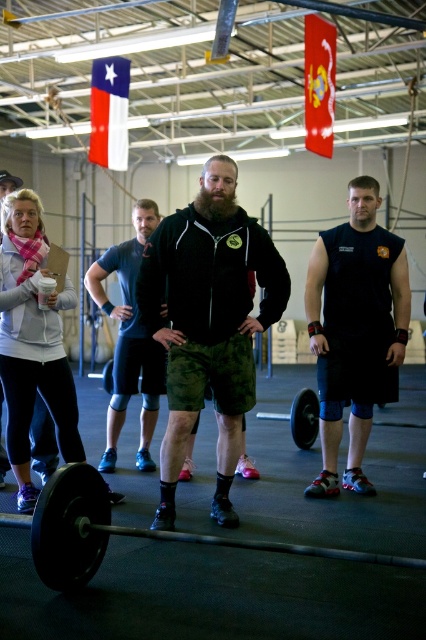
Is point (54, 538) positioned behind point (97, 266)?

No, it is not.

Which is above, black rubber barbell at center or dark blue fabric shorts at center?

dark blue fabric shorts at center is higher up.

I want to click on black rubber barbell at center, so click(x=123, y=532).

Can you confirm if camouflage shorts at center is taller than black sleeveless shirt at right?

No, camouflage shorts at center is not taller than black sleeveless shirt at right.

Does point (261, 268) come closer to viewer compared to point (317, 273)?

Yes, point (261, 268) is in front of point (317, 273).

Where is `camouflage shorts at center`? This screenshot has width=426, height=640. camouflage shorts at center is located at coordinates (207, 323).

Is point (180, 296) closer to viewer compared to point (135, 252)?

Yes, point (180, 296) is closer to viewer.

Can you confirm if camouflage shorts at center is positioned above dark blue fabric shorts at center?

Yes.

Where is `camouflage shorts at center`? Image resolution: width=426 pixels, height=640 pixels. camouflage shorts at center is located at coordinates (207, 323).